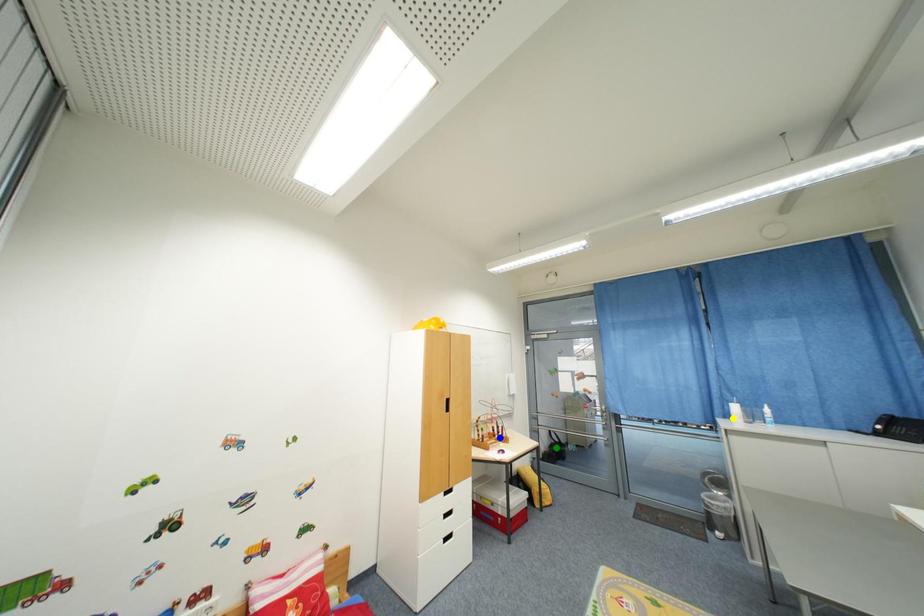
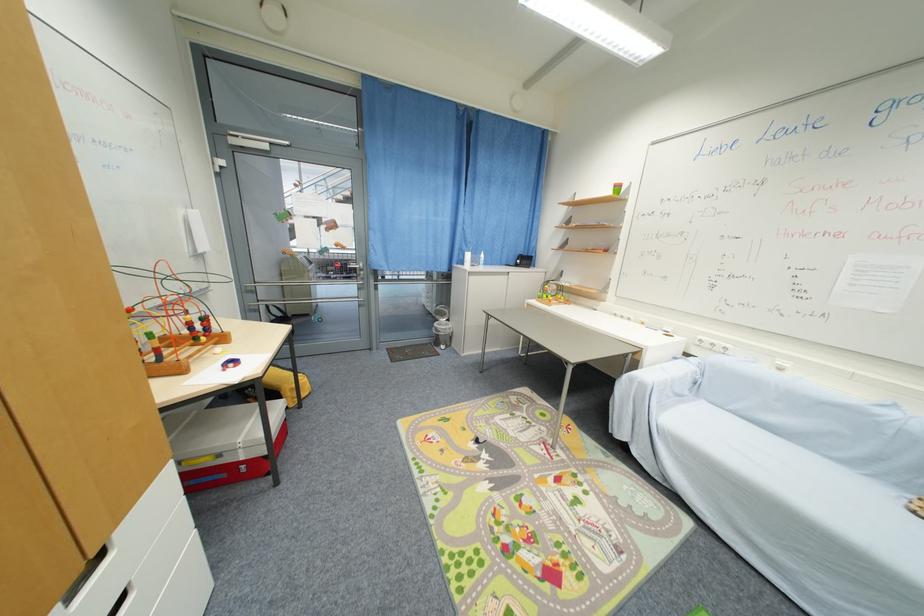
I am providing you with two images of the same scene from different viewpoints. Three points are marked in image1. Which point corresponds to a part or object that is occluded in image2?In image1, three points are marked. Which of them correspond to a part or object that is occluded in image2?Among the three points shown in image1, which one corresponds to a part or object that is no longer visible due to occlusion in image2?

green point